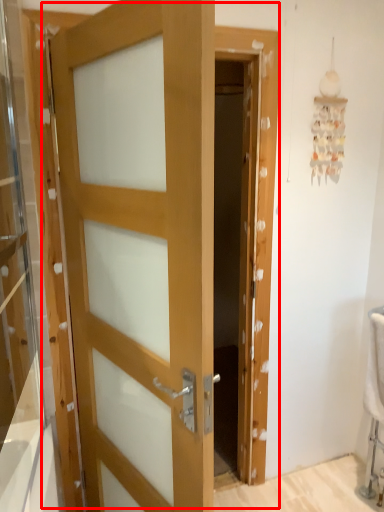
Question: From the image's perspective, what is the correct spatial relationship of door (annotated by the red box) in relation to glass door?

Choices:
 (A) below
 (B) above

Answer: (A)